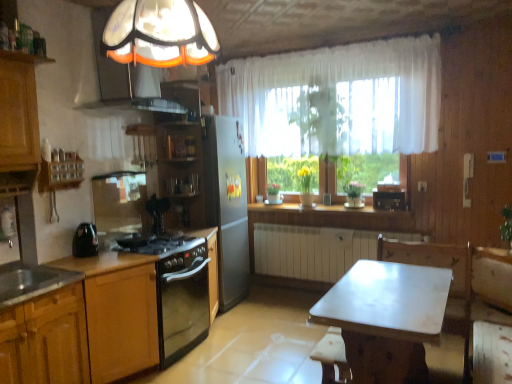
The image size is (512, 384). I want to click on wooden cabinet at lower left, the first cabinetry in the left-to-right sequence, so click(46, 340).

The width and height of the screenshot is (512, 384). What do you see at coordinates (389, 200) in the screenshot?
I see `black plastic radio at center, which appears as the first appliance when viewed from the right` at bounding box center [389, 200].

Locate an element on the screen. This screenshot has width=512, height=384. white sheer curtain at upper center is located at coordinates (338, 99).

Locate an element on the screen. The image size is (512, 384). stainless steel sink at lower left is located at coordinates (31, 282).

Who is shorter, white marble table at center or matte glass exhaust hood at upper left?

matte glass exhaust hood at upper left.

Does point (396, 326) appear closer or farther from the camera than point (114, 93)?

Point (396, 326).

Could you tell me if white marble table at center is facing matte glass exhaust hood at upper left?

No, white marble table at center is not aimed at matte glass exhaust hood at upper left.

From a real-world perspective, is wooden bar stool at lower center located beneath black glossy kettle at left?

Yes, from a real-world perspective, wooden bar stool at lower center is beneath black glossy kettle at left.

Is wooden bar stool at lower center inside or outside of black glossy kettle at left?

wooden bar stool at lower center cannot be found inside black glossy kettle at left.

Which of these two, wooden bar stool at lower center or black glossy kettle at left, is smaller?

black glossy kettle at left.

Are wooden bar stool at lower center and black glossy kettle at left far apart?

Yes.

Based on the photo, would you say black matte stove at left, the 1th appliance positioned from the front, is to the left or to the right of black plastic radio at center, which appears as the first appliance when viewed from the right, in the picture?

black matte stove at left, the 1th appliance positioned from the front, is positioned on black plastic radio at center, which appears as the first appliance when viewed from the right,'s left side.

In terms of width, does black matte stove at left, marked as the 1th appliance in a left-to-right arrangement, look wider or thinner when compared to black plastic radio at center, which appears as the first appliance when viewed from the right?

In the image, black matte stove at left, marked as the 1th appliance in a left-to-right arrangement, appears to be more narrow than black plastic radio at center, which appears as the first appliance when viewed from the right.

From the image's perspective, is black matte stove at left, marked as the 1th appliance in a left-to-right arrangement, located above or below black plastic radio at center, which is the first appliance from back to front?

Clearly, from the image's perspective, black matte stove at left, marked as the 1th appliance in a left-to-right arrangement, is below black plastic radio at center, which is the first appliance from back to front.

In the scene shown: Is black matte stove at left, positioned as the second appliance in right-to-left order, not near black plastic radio at center, which is the first appliance from back to front?

Yes, black matte stove at left, positioned as the second appliance in right-to-left order, is far from black plastic radio at center, which is the first appliance from back to front.

How distant is black glass gas stove at lower left from wooden cabinet at lower left, positioned as the 2th cabinetry in left-to-right order?

A distance of 55.25 centimeters exists between black glass gas stove at lower left and wooden cabinet at lower left, positioned as the 2th cabinetry in left-to-right order.

Considering the sizes of objects black glass gas stove at lower left and wooden cabinet at lower left, positioned as the 2th cabinetry in left-to-right order, in the image provided, who is bigger, black glass gas stove at lower left or wooden cabinet at lower left, positioned as the 2th cabinetry in left-to-right order,?

wooden cabinet at lower left, positioned as the 2th cabinetry in left-to-right order, is bigger.

Are black glass gas stove at lower left and wooden cabinet at lower left, marked as the first cabinetry in a right-to-left arrangement, making contact?

No, black glass gas stove at lower left is not touching wooden cabinet at lower left, marked as the first cabinetry in a right-to-left arrangement.

Is black glass gas stove at lower left inside the boundaries of wooden cabinet at lower left, positioned as the 2th cabinetry in left-to-right order, or outside?

The correct answer is: outside.

From a real-world perspective, between white sheer curtain at upper center and black glossy kettle at left, who is vertically lower?

From a 3D spatial view, black glossy kettle at left is below.

Find the location of a particular element. This screenshot has width=512, height=384. kitchen appliance on the left of the white sheer curtain at upper center is located at coordinates (85, 240).

Would you consider white sheer curtain at upper center to be distant from black glossy kettle at left?

white sheer curtain at upper center is positioned a significant distance from black glossy kettle at left.

Is point (378, 135) more distant than point (86, 237)?

Yes, it is behind point (86, 237).

Is white marble table at center looking in the opposite direction of wooden cabinet at lower left, the first cabinetry in the left-to-right sequence?

white marble table at center does not have its back to wooden cabinet at lower left, the first cabinetry in the left-to-right sequence.

Who is shorter, white marble table at center or wooden cabinet at lower left, the first cabinetry in the left-to-right sequence?

white marble table at center is shorter.

Which object is wider, white marble table at center or wooden cabinet at lower left, the first cabinetry in the left-to-right sequence?

Wider between the two is white marble table at center.

Where is `table located in front of the wooden cabinet at lower left, which is the 2th cabinetry from right to left`? Image resolution: width=512 pixels, height=384 pixels. table located in front of the wooden cabinet at lower left, which is the 2th cabinetry from right to left is located at coordinates (386, 318).

Is wooden bar stool at lower center situated inside white sheer curtain at upper center or outside?

wooden bar stool at lower center is located beyond the bounds of white sheer curtain at upper center.

In the scene shown: Is white sheer curtain at upper center at the back of wooden bar stool at lower center?

No, white sheer curtain at upper center is not at the back of wooden bar stool at lower center.

Which is nearer, [329,354] or [295,73]?

Point [329,354] is closer to the camera than point [295,73].

What's the angular difference between wooden bar stool at lower center and white sheer curtain at upper center's facing directions?

There is a 89.7-degree angle between the facing directions of wooden bar stool at lower center and white sheer curtain at upper center.

Identify the location of table lying on the right of matte glass exhaust hood at upper left. (386, 318).

The height and width of the screenshot is (384, 512). Find the location of `bar stool below the black glossy kettle at left (from a real-world perspective)`. bar stool below the black glossy kettle at left (from a real-world perspective) is located at coordinates (332, 358).

When comparing their distances from wooden cabinet at lower left, positioned as the 2th cabinetry in left-to-right order, does black plastic radio at center, which is the first appliance from back to front, or wooden cabinet at lower left, the first cabinetry in the left-to-right sequence, seem further?

black plastic radio at center, which is the first appliance from back to front, is further to wooden cabinet at lower left, positioned as the 2th cabinetry in left-to-right order.

From the image, which object appears to be nearer to white sheer curtain at upper center, wooden cabinet at lower left, positioned as the 2th cabinetry in left-to-right order, or wooden cabinet at lower left, which is the 2th cabinetry from right to left?

wooden cabinet at lower left, positioned as the 2th cabinetry in left-to-right order, is closer to white sheer curtain at upper center.

Considering their positions, is wooden bar stool at lower center positioned further to translucent glass lampshade at upper center than stainless steel sink at lower left?

wooden bar stool at lower center lies further to translucent glass lampshade at upper center than the other object.

From the image, which object appears to be nearer to white sheer curtain at upper center, translucent glass lampshade at upper center or matte glass exhaust hood at upper left?

matte glass exhaust hood at upper left is closer to white sheer curtain at upper center.

Consider the image. Looking at the image, which one is located further to matte glass exhaust hood at upper left, black glossy kettle at left or white sheer curtain at upper center?

Based on the image, white sheer curtain at upper center appears to be further to matte glass exhaust hood at upper left.

Looking at the image, which one is located further to white sheer curtain at upper center, black plastic radio at center, which is the first appliance from back to front, or wooden cabinet at lower left, positioned as the 2th cabinetry in left-to-right order?

wooden cabinet at lower left, positioned as the 2th cabinetry in left-to-right order.

Looking at the image, which one is located further to translucent glass lampshade at upper center, wooden table at center or black matte stove at left, the 1th appliance positioned from the front?

wooden table at center is positioned further to the anchor translucent glass lampshade at upper center.

From the image, which object appears to be farther from white marble table at center, matte glass exhaust hood at upper left or wooden cabinet at lower left, which is the 2th cabinetry from right to left?

The object further to white marble table at center is matte glass exhaust hood at upper left.

Identify the location of gas stove between wooden cabinet at lower left, the first cabinetry in the left-to-right sequence, and black matte stove at left, the 1th appliance positioned from the front, along the z-axis. This screenshot has height=384, width=512. (156, 244).

The width and height of the screenshot is (512, 384). What are the coordinates of `kitchen appliance between translucent glass lampshade at upper center and white sheer curtain at upper center along the z-axis` in the screenshot? It's located at (85, 240).

Locate an element on the screen. cabinetry located between wooden cabinet at lower left, which is the 2th cabinetry from right to left, and black glass gas stove at lower left in the depth direction is located at coordinates (122, 323).

In order to click on curtain positioned between translucent glass lampshade at upper center and wooden table at center from near to far in this screenshot , I will do `click(338, 99)`.